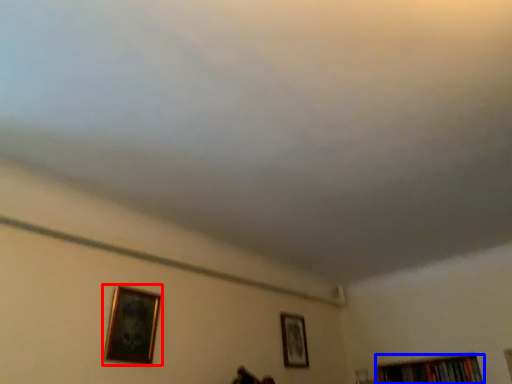
Question: Which object appears closest to the camera in this image, picture frame (highlighted by a red box) or book (highlighted by a blue box)?

Choices:
 (A) picture frame
 (B) book

Answer: (A)